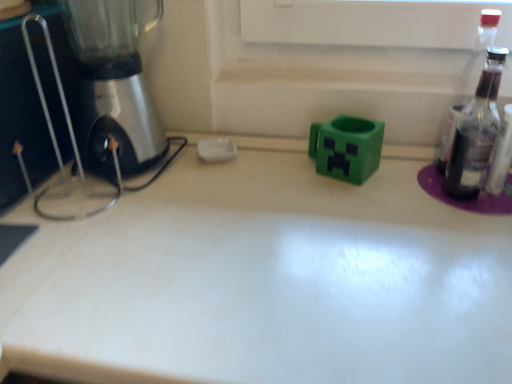
Where is `free space between transparent glass bottle at right and green matte plastic mug at center`? The image size is (512, 384). free space between transparent glass bottle at right and green matte plastic mug at center is located at coordinates (400, 177).